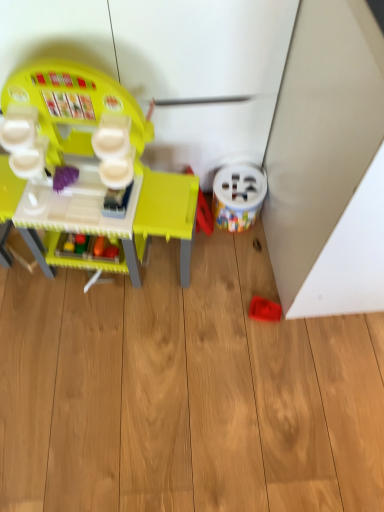
At what (x,y) coordinates should I click in order to perform the action: click on vacant space in front of matte plastic play kitchen at left, positioned as the third toy in right-to-left order. Please return your answer as a coordinate pair (x, y). The image size is (384, 512). Looking at the image, I should click on (102, 369).